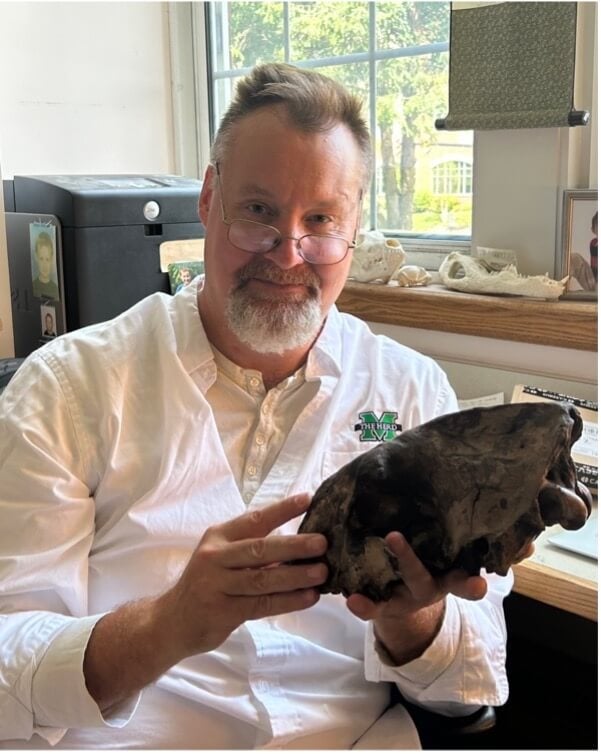
Locate an element on the screen. shelf is located at coordinates (572, 310).